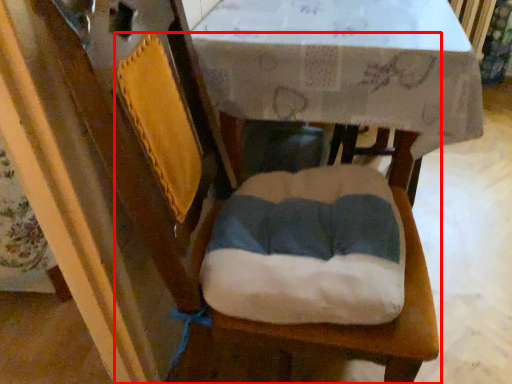
Question: Considering the relative positions of chair (annotated by the red box) and round table in the image provided, where is chair (annotated by the red box) located with respect to the staircase?

Choices:
 (A) right
 (B) left

Answer: (A)